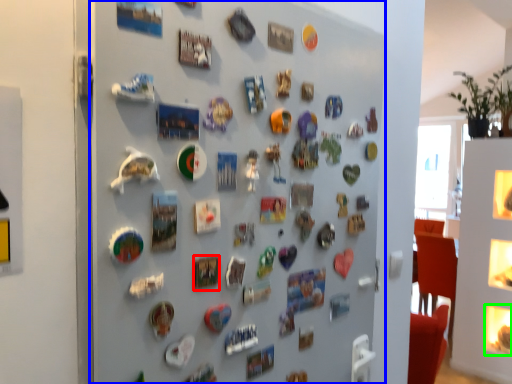
Question: Which object is the closest to the button (highlighted by a red box)? Choose among these: fireplace (highlighted by a blue box) or button (highlighted by a green box).

Choices:
 (A) fireplace
 (B) button

Answer: (A)